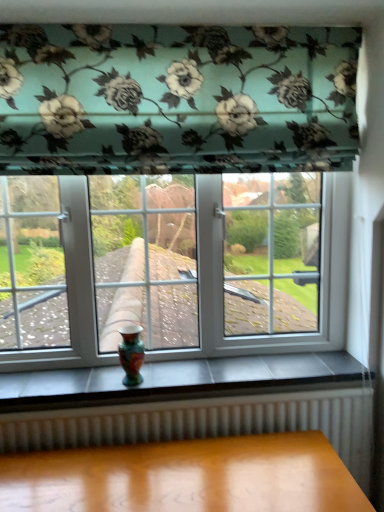
Describe the element at coordinates (131, 354) in the screenshot. This screenshot has width=384, height=512. I see `multicolored glossy vase at lower center` at that location.

This screenshot has height=512, width=384. I want to click on multicolored glossy vase at lower center, so click(x=131, y=354).

Where is `multicolored glossy vase at lower center`? The width and height of the screenshot is (384, 512). multicolored glossy vase at lower center is located at coordinates 131,354.